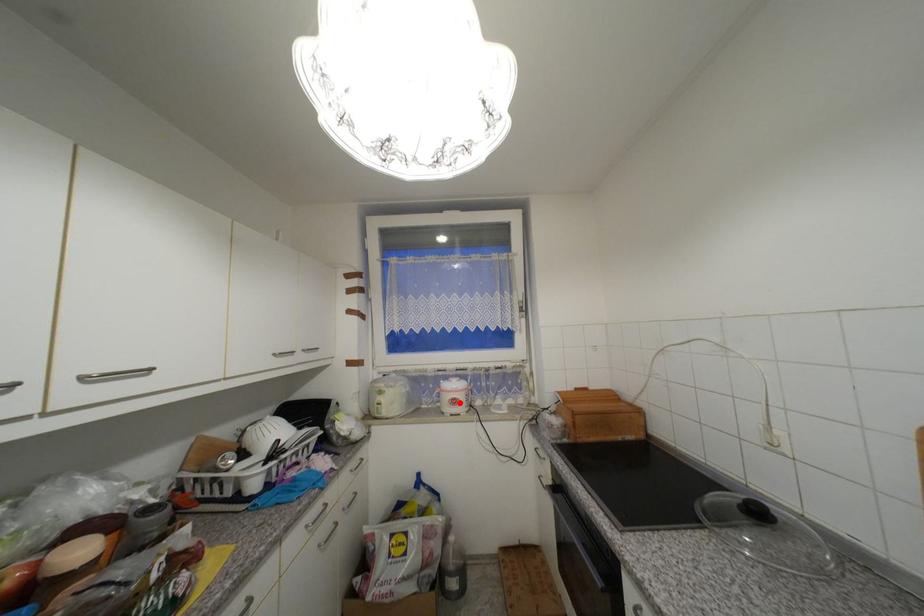
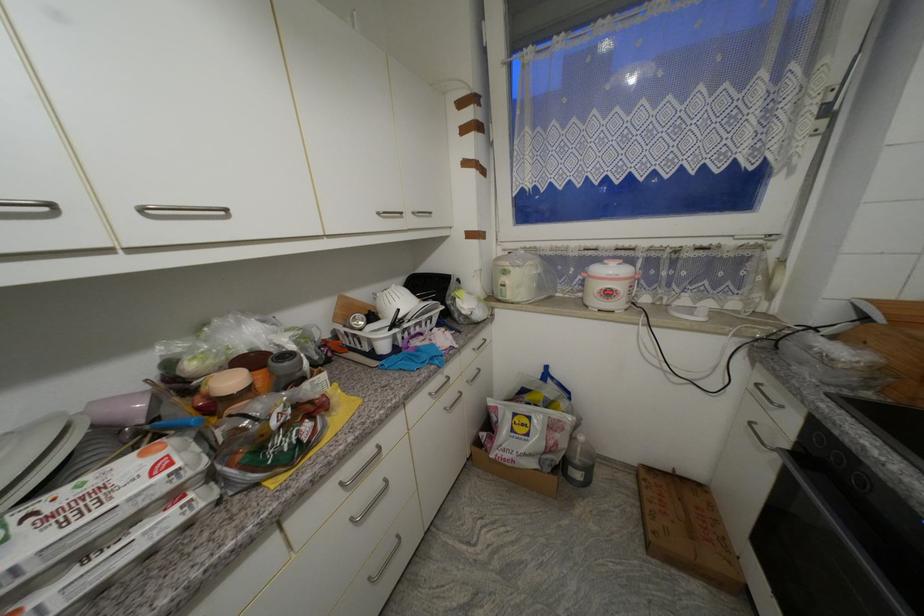
Question: I am providing you with two images of the same scene from different viewpoints. Image1 has a red point marked. In image2, the corresponding 3D location appears at what relative position? Reply with the corresponding letter.

Choices:
 (A) Closer
 (B) Farther

Answer: (A)